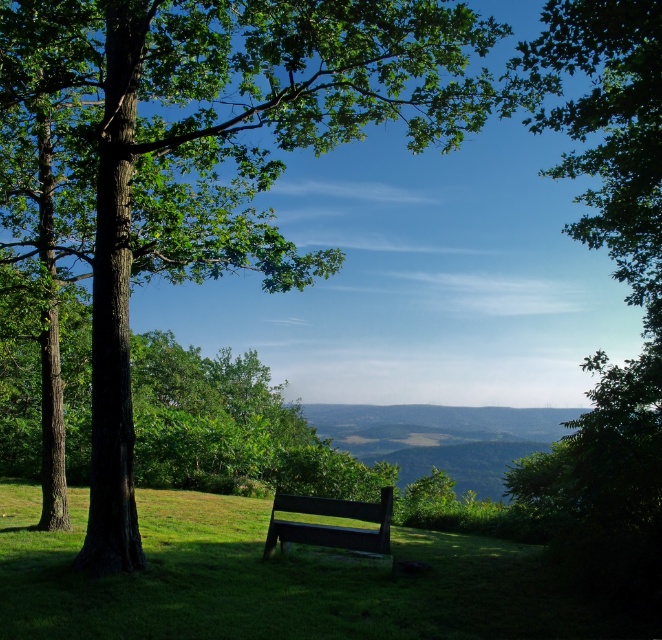
You are sitting on the green matte bench at center and want to touch the green rough bark tree at center. Can you reach it without moving from the bench?

The green rough bark tree at center is closer to the viewer than the green matte bench at center, so yes, you can reach it without moving from the bench.

You are planning to place a new bench in the park. The existing green matte bench at center is already there. If you want to place a bench that is wider than the existing one, can the new bench be placed where the green rough bark tree at center is located?

The green rough bark tree at center is wider than the green matte bench at center. Therefore, placing a bench wider than the existing one at the tree location may not be feasible due to the tree occupying more space.